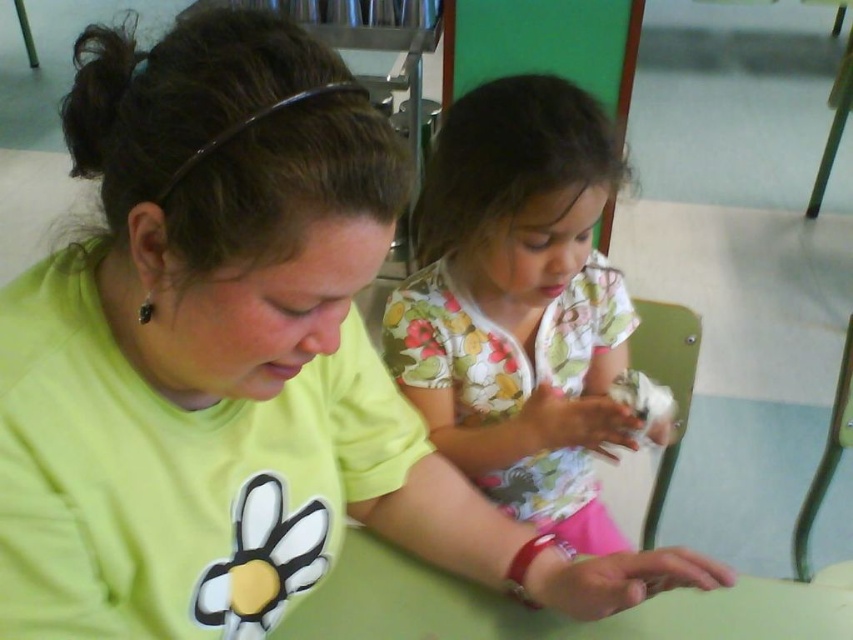
You are a delivery robot that needs to place a small package between the floral cotton shirt at center and the green matte table at center. Can you fit the package in the space between them if the package requires 12 inches of space?

The space between the floral cotton shirt at center and the green matte table at center is 12.80 inches, which is more than enough to accommodate the 12 inch package.